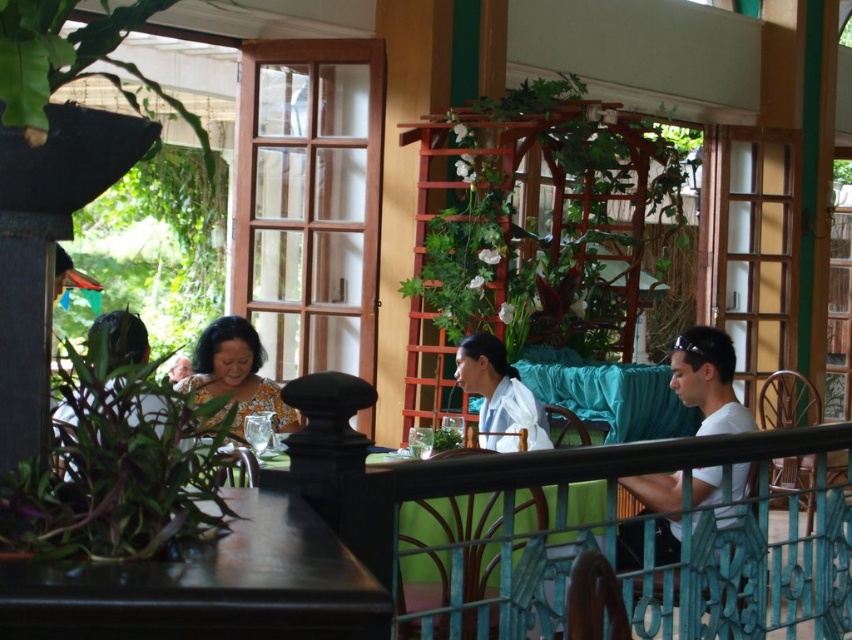
From the picture: You are a photographer standing at the camera position. You want to take a photo of the dark brown wood table at lower left. Can you reach it with your hand to adjust it before taking the photo?

The dark brown wood table at lower left and camera are 1.11 meters apart from each other. Since the distance is about 1.1 meters, you can likely reach the table with your hand to adjust it before taking the photo.

You are a customer at this outdoor dining area and want to place your printed fabric blouse at center on the dark brown wood table at lower left. Will the table be able to accommodate the blouse without it hanging off the edges?

The dark brown wood table at lower left has a smaller size compared to printed fabric blouse at center, so the table is not large enough to fully hold the blouse without it hanging over the edges.

You are a customer sitting at the printed fabric blouse at center and want to reach the dark brown wood table at lower left to grab a napkin. Can you easily reach it without moving your seat?

The dark brown wood table at lower left is positioned on the right side of the printed fabric blouse at center, so you can easily reach it by extending your right arm.